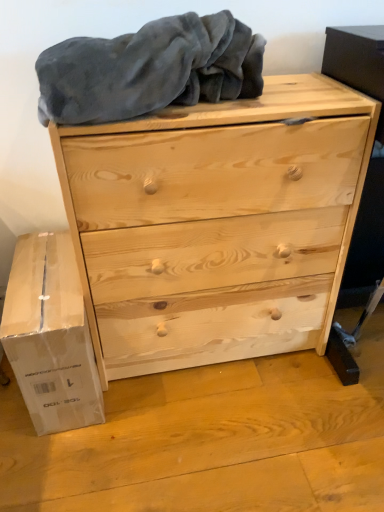
Where is `vacant space to the right of white cardboard box at lower left`? The height and width of the screenshot is (512, 384). vacant space to the right of white cardboard box at lower left is located at coordinates (166, 407).